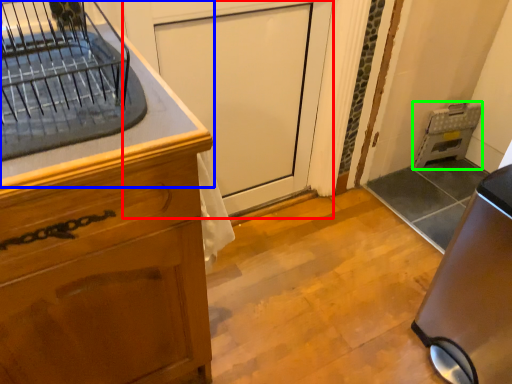
Question: Based on their relative distances, which object is farther from screen door (highlighted by a red box)? Choose from countertop (highlighted by a blue box) and appliance (highlighted by a green box).

Choices:
 (A) countertop
 (B) appliance

Answer: (B)